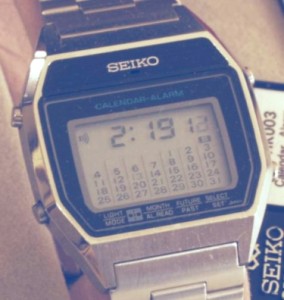
This screenshot has height=300, width=284. In order to click on calendar in this screenshot , I will do `click(100, 170)`, `click(120, 183)`, `click(138, 181)`, `click(160, 181)`, `click(181, 176)`, `click(200, 172)`, `click(216, 171)`.